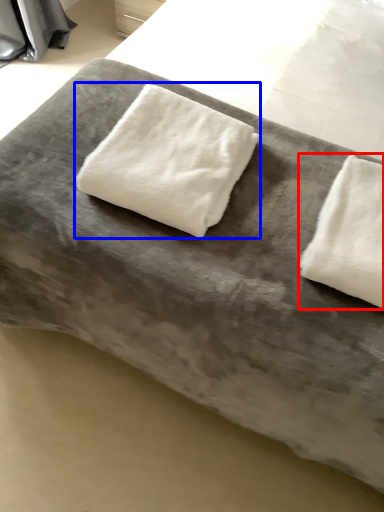
Question: Among these objects, which one is nearest to the camera, towel (highlighted by a red box) or towel (highlighted by a blue box)?

Choices:
 (A) towel
 (B) towel

Answer: (A)